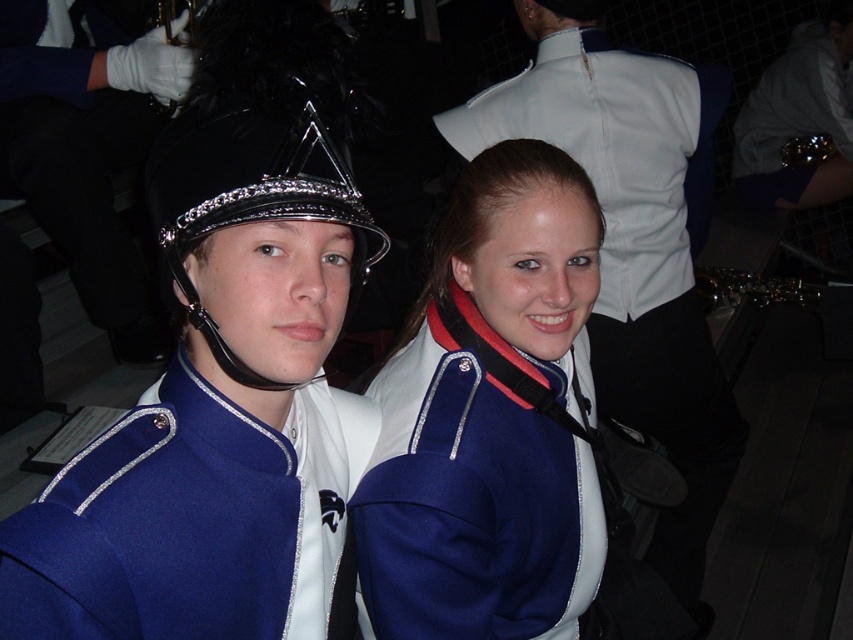
Question: Which point is closer to the camera taking this photo?

Choices:
 (A) (595, 140)
 (B) (287, 188)
 (C) (404, 506)

Answer: (B)

Question: Which point appears farthest from the camera in this image?

Choices:
 (A) (766, 83)
 (B) (334, 161)

Answer: (A)

Question: Is shiny black helmet at center to the right of metallic gold saxophone at lower right from the viewer's perspective?

Choices:
 (A) yes
 (B) no

Answer: (B)

Question: Does blue wool jacket at left appear on the right side of shiny black helmet at center?

Choices:
 (A) yes
 (B) no

Answer: (B)

Question: Which point is closer to the camera?

Choices:
 (A) blue wool jacket at left
 (B) blue woolen jacket at center
 (C) white glossy uniform at upper center
 (D) metallic gold saxophone at lower right

Answer: (A)

Question: Can you confirm if white glossy uniform at upper center is bigger than metallic gold saxophone at lower right?

Choices:
 (A) no
 (B) yes

Answer: (B)